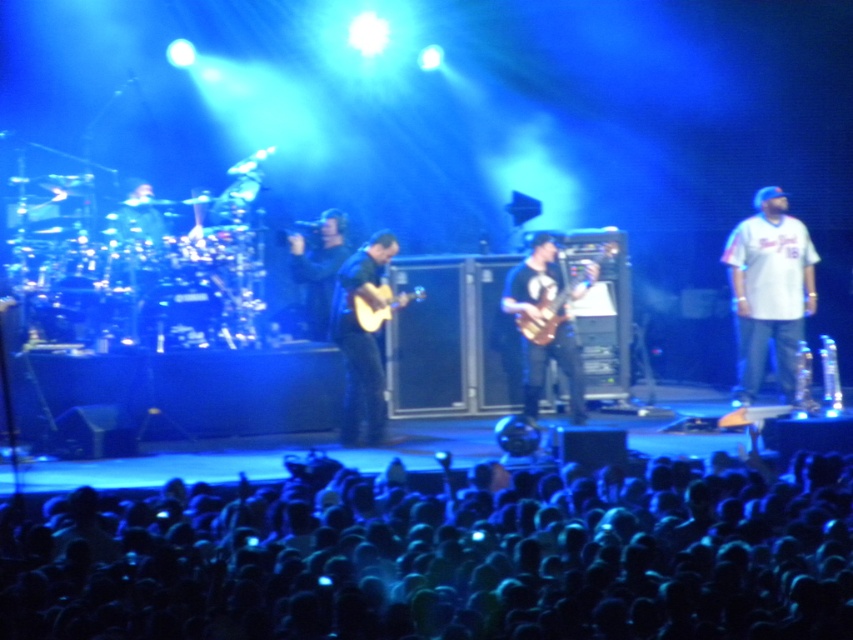
Question: Among these objects, which one is farthest from the camera?

Choices:
 (A) matte black guitar at center
 (B) white cotton shirt at right
 (C) shiny brown electric guitar at center

Answer: (B)

Question: Does white cotton shirt at right have a lesser width compared to acoustic wood guitar at center?

Choices:
 (A) no
 (B) yes

Answer: (A)

Question: Is shiny brown electric guitar at center bigger than acoustic wood guitar at center?

Choices:
 (A) yes
 (B) no

Answer: (A)

Question: Which point is closer to the camera taking this photo?

Choices:
 (A) (367, 412)
 (B) (592, 278)
 (C) (747, 301)

Answer: (A)

Question: Does matte black guitar at center appear over acoustic wood guitar at center?

Choices:
 (A) no
 (B) yes

Answer: (A)

Question: Among these points, which one is nearest to the camera?

Choices:
 (A) (363, 419)
 (B) (509, 292)
 (C) (364, 324)

Answer: (C)